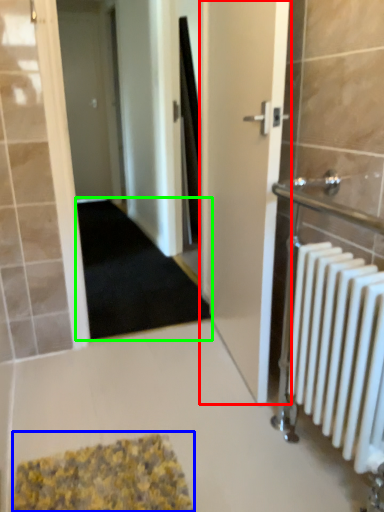
Question: Which object is the farthest from door (highlighted by a red box)? Choose among these: bath mat (highlighted by a blue box) or doormat (highlighted by a green box).

Choices:
 (A) bath mat
 (B) doormat

Answer: (B)